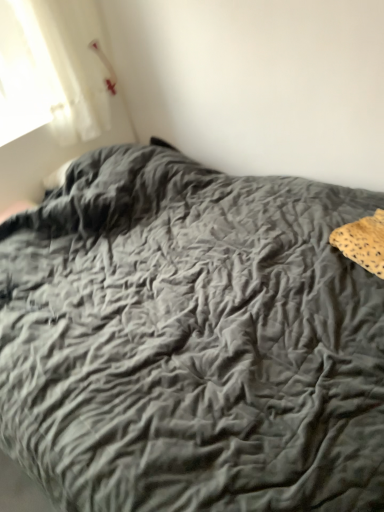
Question: Is leopard print fabric at right wider or thinner than velvet gray bedspread at center?

Choices:
 (A) thin
 (B) wide

Answer: (A)

Question: Is leopard print fabric at right taller or shorter than velvet gray bedspread at center?

Choices:
 (A) short
 (B) tall

Answer: (A)

Question: Looking at the image, does leopard print fabric at right seem bigger or smaller compared to velvet gray bedspread at center?

Choices:
 (A) big
 (B) small

Answer: (B)

Question: In the image, is velvet gray bedspread at center positioned in front of or behind leopard print fabric at right?

Choices:
 (A) front
 (B) behind

Answer: (A)

Question: Considering the relative positions of velvet gray bedspread at center and leopard print fabric at right in the image provided, is velvet gray bedspread at center to the left or to the right of leopard print fabric at right?

Choices:
 (A) left
 (B) right

Answer: (A)

Question: Is velvet gray bedspread at center spatially inside leopard print fabric at right, or outside of it?

Choices:
 (A) outside
 (B) inside

Answer: (A)

Question: Considering the positions of velvet gray bedspread at center and leopard print fabric at right in the image, is velvet gray bedspread at center taller or shorter than leopard print fabric at right?

Choices:
 (A) tall
 (B) short

Answer: (A)